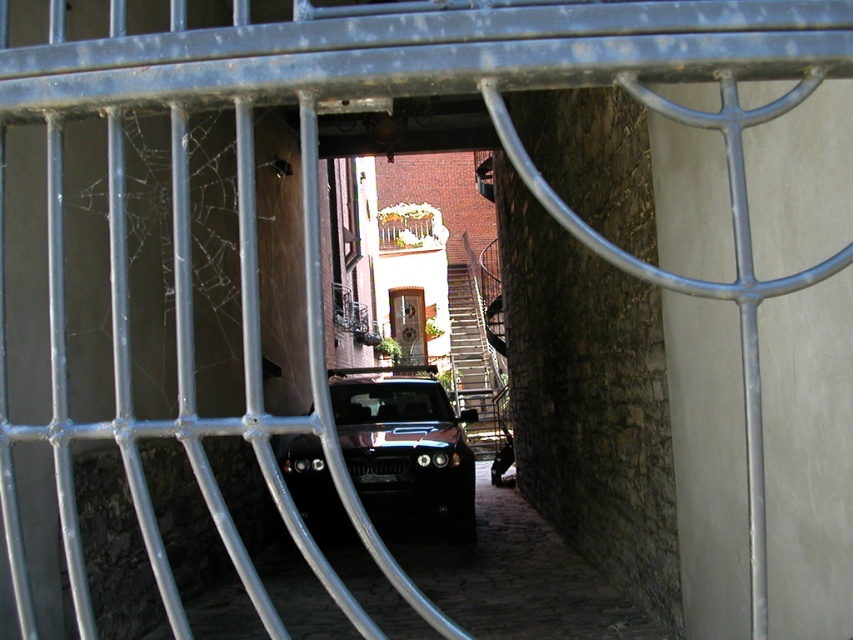
Question: Can you confirm if glossy black jeep at center is positioned to the right of wooden door at center?

Choices:
 (A) no
 (B) yes

Answer: (B)

Question: Among these points, which one is nearest to the camera?

Choices:
 (A) (412, 300)
 (B) (451, 296)
 (C) (463, 461)

Answer: (C)

Question: Which of the following is the closest to the observer?

Choices:
 (A) (454, 282)
 (B) (393, 308)
 (C) (360, 483)

Answer: (C)

Question: Observing the image, what is the correct spatial positioning of glossy black jeep at center in reference to metallic silver stairs at center?

Choices:
 (A) above
 (B) below

Answer: (B)

Question: Which object is the farthest from the metallic silver stairs at center?

Choices:
 (A) glossy black jeep at center
 (B) wooden door at center

Answer: (A)

Question: Does metallic silver stairs at center have a larger size compared to wooden door at center?

Choices:
 (A) yes
 (B) no

Answer: (A)